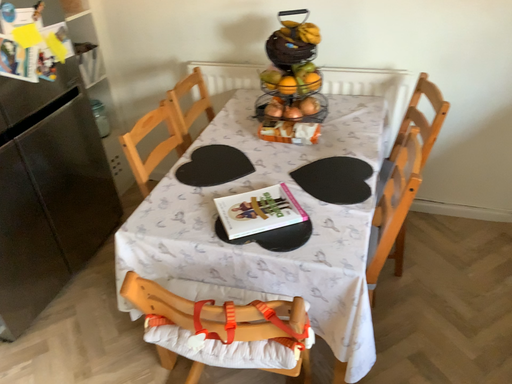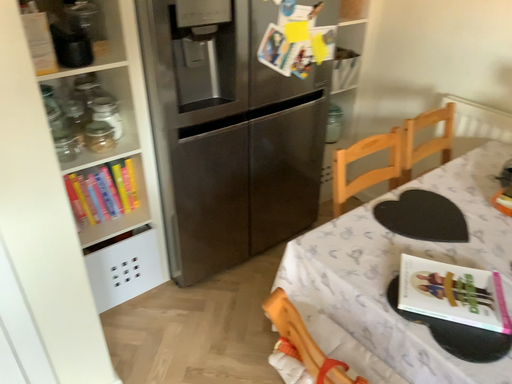
Question: Which way did the camera rotate in the video?

Choices:
 (A) rotated downward
 (B) rotated upward

Answer: (B)